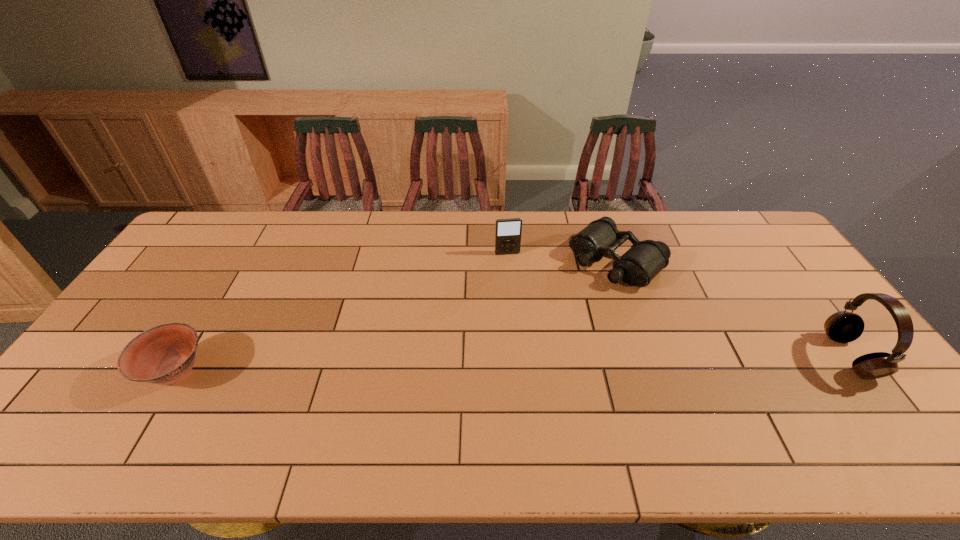
This screenshot has height=540, width=960. What are the coordinates of `free space on the desktop that is between the leftmost object and the headset and is positioned on the front-facing side of the third object from right to left` in the screenshot? It's located at (533, 363).

The height and width of the screenshot is (540, 960). I want to click on vacant space on the desktop that is between the bowl and the headset and is positioned through the eyepieces of the binoculars, so tap(499, 364).